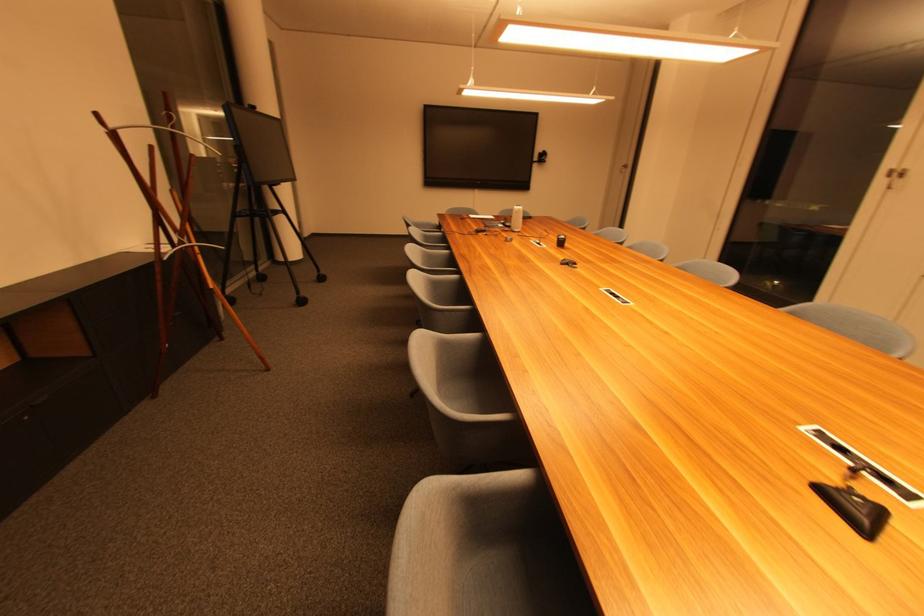
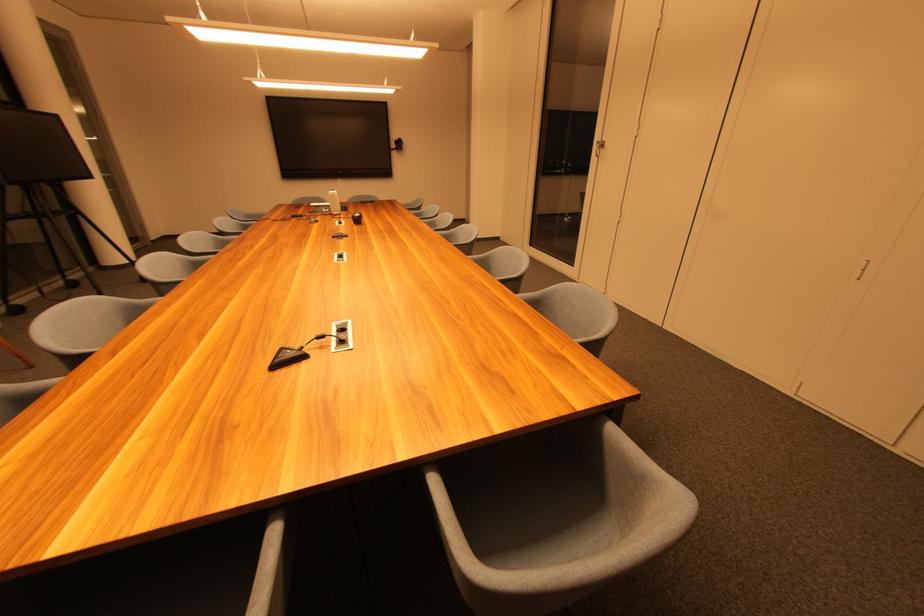
Locate, in the second image, the point that corresponds to the point at 894,166 in the first image.

(602, 140)